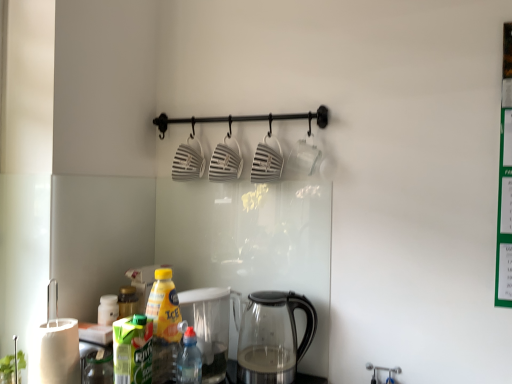
Question: From the image's perspective, is transparent glass kettle at lower center located above or below yellow plastic bottle at lower left, arranged as the first bottle when viewed from the left?

Choices:
 (A) above
 (B) below

Answer: (B)

Question: Would you say transparent glass kettle at lower center is to the left or to the right of yellow plastic bottle at lower left, arranged as the first bottle when viewed from the left, in the picture?

Choices:
 (A) right
 (B) left

Answer: (A)

Question: Estimate the real-world distances between objects in this image. Which object is closer to the transparent glass kettle at lower center?

Choices:
 (A) yellow plastic bottle at lower left, arranged as the first bottle when viewed from the left
 (B) translucent plastic bottle at lower center, arranged as the 2th bottle when viewed from the left

Answer: (B)

Question: Considering the real-world distances, which object is farthest from the yellow plastic bottle at lower left, arranged as the first bottle when viewed from the left?

Choices:
 (A) translucent plastic bottle at lower center, arranged as the 2th bottle when viewed from the left
 (B) transparent glass kettle at lower center

Answer: (B)